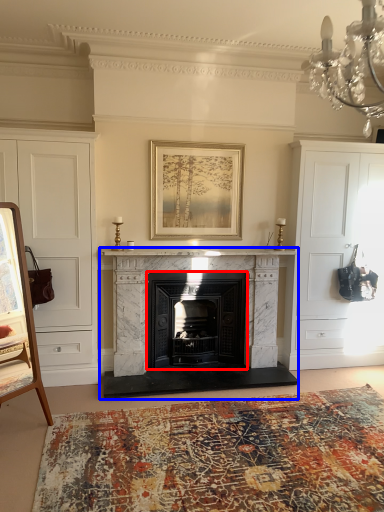
Question: Which object appears closest to the camera in this image, fireplace (highlighted by a red box) or fireplace (highlighted by a blue box)?

Choices:
 (A) fireplace
 (B) fireplace

Answer: (B)